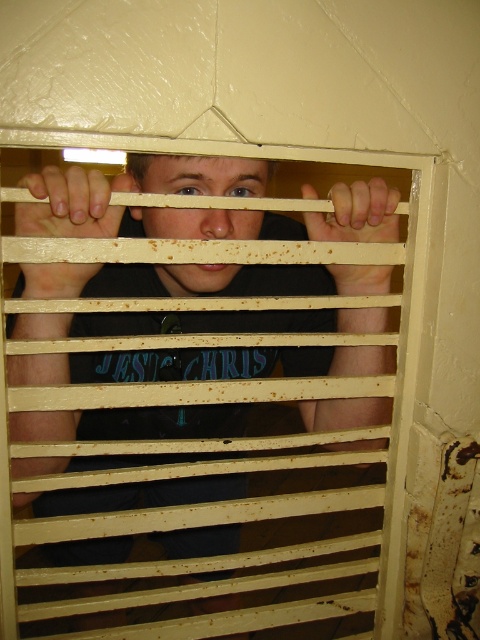
Based on the photo, does matte black shirt at center appear on the right side of matte wood hand at left?

Yes, matte black shirt at center is to the right of matte wood hand at left.

This screenshot has width=480, height=640. In order to click on matte black shirt at center in this screenshot , I will do `click(197, 280)`.

Which of these two, matte wood hand at left or brown wooden hand at center, stands shorter?

matte wood hand at left is shorter.

Is point (75, 236) closer to viewer compared to point (382, 204)?

Yes, it is.

Who is more distant from viewer, [57,221] or [395,216]?

Point [395,216]

At what (x,y) coordinates should I click in order to perform the action: click on matte wood hand at left. Please return your answer as a coordinate pair (x, y). The image size is (480, 640). Looking at the image, I should click on (71, 204).

Does point (240, 330) lie behind point (380, 282)?

Yes, it is.

Is point (121, 465) closer to camera compared to point (372, 188)?

No, (121, 465) is behind (372, 188).

Where is `matte black shirt at center`? This screenshot has width=480, height=640. matte black shirt at center is located at coordinates (197, 280).